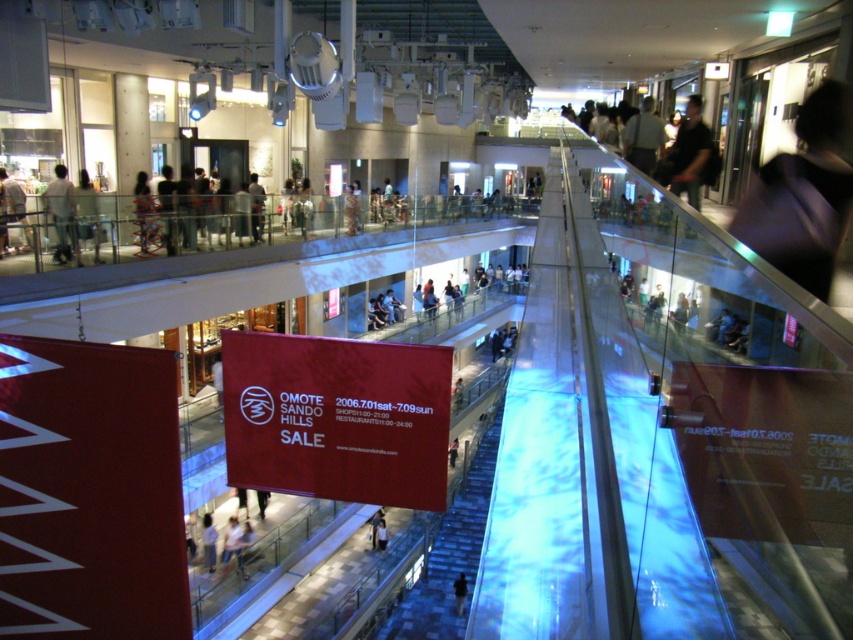
You are a delivery person carrying a large box that is 1.2 meters wide. You need to move from the lower level to the upper level of the mall atrium. Can you fit through the translucent glass escalator at center? Please consider the width of the light brown leather jacket at lower center as a reference point.

The translucent glass escalator at center is wider than the light brown leather jacket at lower center. Since the jacket is narrower than the escalator, and your box is 1.2 meters wide, you need to compare the escalator width with your box. However, without knowing the exact width of the escalator, we can only infer it is wider than the jacket. If the jacket is smaller than 1.2 meters, the escalator might accommodate your box. Otherwise, it might not. The information provided is insufficient to confirm.

You are standing at the lower level of the mall and want to reach the upper shops. There is a point marked at coordinates (444, 548). What is the object located at that point that you can use to ascend?

The point at coordinates (444, 548) marks the translucent glass escalator at center, which you can use to ascend to the upper level shops.